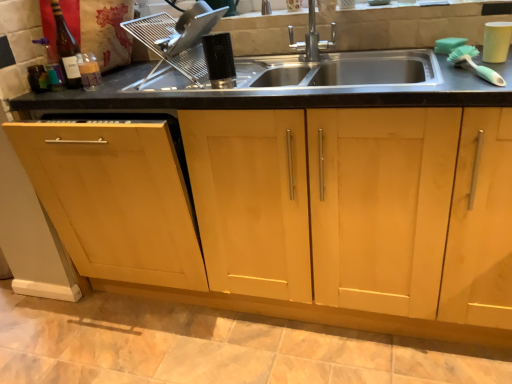
Locate an element on the screen. light wood cabinet at center is located at coordinates (306, 220).

Where is `black plastic comb at center, which is counted as the second appliance, starting from the right`? The height and width of the screenshot is (384, 512). black plastic comb at center, which is counted as the second appliance, starting from the right is located at coordinates (219, 60).

At what (x,y) coordinates should I click in order to perform the action: click on translucent glass bottle at upper left. Please return your answer as a coordinate pair (x, y). The image size is (512, 384). Looking at the image, I should click on (66, 49).

Identify the location of satin silver dish rack at upper center, acting as the first appliance starting from the left. This screenshot has width=512, height=384. (177, 38).

Identify the location of white matte cup at upper right, the 3th appliance positioned from the left. This screenshot has height=384, width=512. (496, 41).

Does point (184, 37) lie behind point (325, 209)?

Yes.

How distant is satin silver dish rack at upper center, acting as the first appliance starting from the left, from light wood cabinet at center?

The distance of satin silver dish rack at upper center, acting as the first appliance starting from the left, from light wood cabinet at center is 23.15 inches.

Can you tell me how much satin silver dish rack at upper center, which is the 3th appliance from right to left, and light wood cabinet at center differ in facing direction?

1.02 degrees separate the facing orientations of satin silver dish rack at upper center, which is the 3th appliance from right to left, and light wood cabinet at center.

From the image's perspective, between satin silver dish rack at upper center, which is the 3th appliance from right to left, and light wood cabinet at center, which one is located above?

satin silver dish rack at upper center, which is the 3th appliance from right to left, appears higher in the image.

From their relative heights in the image, would you say satin silver dish rack at upper center, acting as the first appliance starting from the left, is taller or shorter than black plastic comb at center, positioned as the 2th appliance in left-to-right order?

Clearly, satin silver dish rack at upper center, acting as the first appliance starting from the left, is taller compared to black plastic comb at center, positioned as the 2th appliance in left-to-right order.

Consider the image. Considering the relative positions of satin silver dish rack at upper center, which is the 3th appliance from right to left, and black plastic comb at center, which is counted as the second appliance, starting from the right, in the image provided, is satin silver dish rack at upper center, which is the 3th appliance from right to left, in front of black plastic comb at center, which is counted as the second appliance, starting from the right,?

No.

Based on the photo, does satin silver dish rack at upper center, which is the 3th appliance from right to left, appear on the left side of black plastic comb at center, positioned as the 2th appliance in left-to-right order?

Yes, satin silver dish rack at upper center, which is the 3th appliance from right to left, is to the left of black plastic comb at center, positioned as the 2th appliance in left-to-right order.

Between satin silver dish rack at upper center, which is the 3th appliance from right to left, and black plastic comb at center, positioned as the 2th appliance in left-to-right order, which one has smaller size?

black plastic comb at center, positioned as the 2th appliance in left-to-right order, is smaller.

Consider the image. From a real-world perspective, is translucent glass bottle at upper left on top of white matte cup at upper right, the first appliance positioned from the right?

Yes, from a real-world perspective, translucent glass bottle at upper left is above white matte cup at upper right, the first appliance positioned from the right.

Is translucent glass bottle at upper left positioned beyond the bounds of white matte cup at upper right, the 3th appliance positioned from the left?

Yes, translucent glass bottle at upper left is outside of white matte cup at upper right, the 3th appliance positioned from the left.

Is translucent glass bottle at upper left in contact with white matte cup at upper right, the 3th appliance positioned from the left?

No, translucent glass bottle at upper left is not beside white matte cup at upper right, the 3th appliance positioned from the left.

Where is `bottle lying above the white matte cup at upper right, the first appliance positioned from the right (from the image's perspective)`? bottle lying above the white matte cup at upper right, the first appliance positioned from the right (from the image's perspective) is located at coordinates [x=66, y=49].

Is the position of translucent glass bottle at upper left more distant than that of black plastic comb at center, positioned as the 2th appliance in left-to-right order?

That is True.

Does translucent glass bottle at upper left have a lesser width compared to black plastic comb at center, which is counted as the second appliance, starting from the right?

Yes, translucent glass bottle at upper left is thinner than black plastic comb at center, which is counted as the second appliance, starting from the right.

Is translucent glass bottle at upper left surrounding black plastic comb at center, which is counted as the second appliance, starting from the right?

No, black plastic comb at center, which is counted as the second appliance, starting from the right, is not surrounded by translucent glass bottle at upper left.

Is there a large distance between translucent glass bottle at upper left and satin silver dish rack at upper center, acting as the first appliance starting from the left?

No, translucent glass bottle at upper left is not far away from satin silver dish rack at upper center, acting as the first appliance starting from the left.

Considering the positions of objects translucent glass bottle at upper left and satin silver dish rack at upper center, which is the 3th appliance from right to left, in the image provided, who is more to the right, translucent glass bottle at upper left or satin silver dish rack at upper center, which is the 3th appliance from right to left,?

satin silver dish rack at upper center, which is the 3th appliance from right to left, is more to the right.

Which is behind, point (60, 15) or point (166, 16)?

Positioned behind is point (166, 16).

Is light wood cabinet at center positioned far away from satin silver dish rack at upper center, which is the 3th appliance from right to left?

That's not correct — light wood cabinet at center is a little close to satin silver dish rack at upper center, which is the 3th appliance from right to left.

Considering the relative positions of light wood cabinet at center and satin silver dish rack at upper center, acting as the first appliance starting from the left, in the image provided, is light wood cabinet at center behind satin silver dish rack at upper center, acting as the first appliance starting from the left,?

No, light wood cabinet at center is in front of satin silver dish rack at upper center, acting as the first appliance starting from the left.

Between light wood cabinet at center and satin silver dish rack at upper center, which is the 3th appliance from right to left, which one appears on the left side from the viewer's perspective?

satin silver dish rack at upper center, which is the 3th appliance from right to left.

From the image's perspective, between light wood cabinet at center and satin silver dish rack at upper center, acting as the first appliance starting from the left, who is located below?

light wood cabinet at center, from the image's perspective.

Could you tell me if light wood cabinet at center is facing black plastic comb at center, which is counted as the second appliance, starting from the right?

No.

Considering the relative sizes of light wood cabinet at center and black plastic comb at center, which is counted as the second appliance, starting from the right, in the image provided, is light wood cabinet at center shorter than black plastic comb at center, which is counted as the second appliance, starting from the right,?

No.

Looking at this image, from the image's perspective, who appears lower, light wood cabinet at center or black plastic comb at center, positioned as the 2th appliance in left-to-right order?

light wood cabinet at center.

At what (x,y) coordinates should I click in order to perform the action: click on cabinetry in front of the satin silver dish rack at upper center, acting as the first appliance starting from the left. Please return your answer as a coordinate pair (x, y). Looking at the image, I should click on (306, 220).

Locate an element on the screen. the 1st appliance to the right of the satin silver dish rack at upper center, acting as the first appliance starting from the left, counting from the anchor's position is located at coordinates (219, 60).

Considering their positions, is black plastic comb at center, positioned as the 2th appliance in left-to-right order, positioned closer to light wood cabinet at center than white matte cup at upper right, the first appliance positioned from the right?

Based on the image, black plastic comb at center, positioned as the 2th appliance in left-to-right order, appears to be nearer to light wood cabinet at center.

From the image, which object appears to be nearer to translucent glass bottle at upper left, white matte cup at upper right, the 3th appliance positioned from the left, or satin silver dish rack at upper center, acting as the first appliance starting from the left?

satin silver dish rack at upper center, acting as the first appliance starting from the left, lies closer to translucent glass bottle at upper left than the other object.

Based on their spatial positions, is white matte cup at upper right, the 3th appliance positioned from the left, or light wood cabinet at center closer to translucent glass bottle at upper left?

light wood cabinet at center lies closer to translucent glass bottle at upper left than the other object.

Based on their spatial positions, is light wood cabinet at center or white matte cup at upper right, the first appliance positioned from the right, further from satin silver dish rack at upper center, which is the 3th appliance from right to left?

Among the two, white matte cup at upper right, the first appliance positioned from the right, is located further to satin silver dish rack at upper center, which is the 3th appliance from right to left.

From the image, which object appears to be farther from black plastic comb at center, which is counted as the second appliance, starting from the right, light wood cabinet at center or translucent glass bottle at upper left?

light wood cabinet at center is further to black plastic comb at center, which is counted as the second appliance, starting from the right.

From the image, which object appears to be farther from satin silver dish rack at upper center, which is the 3th appliance from right to left, white matte cup at upper right, the first appliance positioned from the right, or light wood cabinet at center?

white matte cup at upper right, the first appliance positioned from the right, is further to satin silver dish rack at upper center, which is the 3th appliance from right to left.

From the image, which object appears to be nearer to light wood cabinet at center, black plastic comb at center, positioned as the 2th appliance in left-to-right order, or satin silver dish rack at upper center, which is the 3th appliance from right to left?

Based on the image, black plastic comb at center, positioned as the 2th appliance in left-to-right order, appears to be nearer to light wood cabinet at center.

Which object lies nearer to the anchor point translucent glass bottle at upper left, satin silver dish rack at upper center, acting as the first appliance starting from the left, or black plastic comb at center, which is counted as the second appliance, starting from the right?

Based on the image, satin silver dish rack at upper center, acting as the first appliance starting from the left, appears to be nearer to translucent glass bottle at upper left.

Find the location of `cabinetry located between black plastic comb at center, positioned as the 2th appliance in left-to-right order, and white matte cup at upper right, the first appliance positioned from the right, in the left-right direction`. cabinetry located between black plastic comb at center, positioned as the 2th appliance in left-to-right order, and white matte cup at upper right, the first appliance positioned from the right, in the left-right direction is located at coordinates (306, 220).

This screenshot has height=384, width=512. Find the location of `cabinetry situated between translucent glass bottle at upper left and white matte cup at upper right, the 3th appliance positioned from the left, from left to right`. cabinetry situated between translucent glass bottle at upper left and white matte cup at upper right, the 3th appliance positioned from the left, from left to right is located at coordinates (306, 220).

Image resolution: width=512 pixels, height=384 pixels. Find the location of `appliance between translucent glass bottle at upper left and black plastic comb at center, which is counted as the second appliance, starting from the right, from left to right`. appliance between translucent glass bottle at upper left and black plastic comb at center, which is counted as the second appliance, starting from the right, from left to right is located at coordinates (177, 38).

Identify the location of appliance between satin silver dish rack at upper center, which is the 3th appliance from right to left, and white matte cup at upper right, the 3th appliance positioned from the left. The image size is (512, 384). (219, 60).